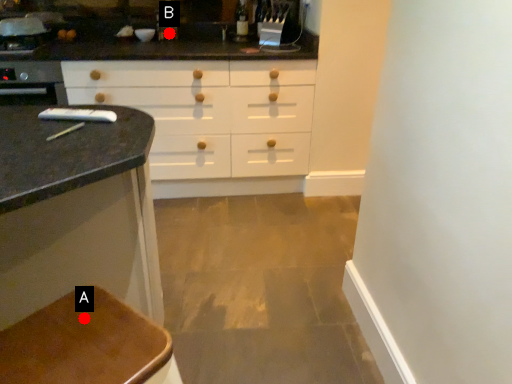
Question: Two points are circled on the image, labeled by A and B beside each circle. Among these points, which one is farthest from the camera?

Choices:
 (A) A is further
 (B) B is further

Answer: (B)